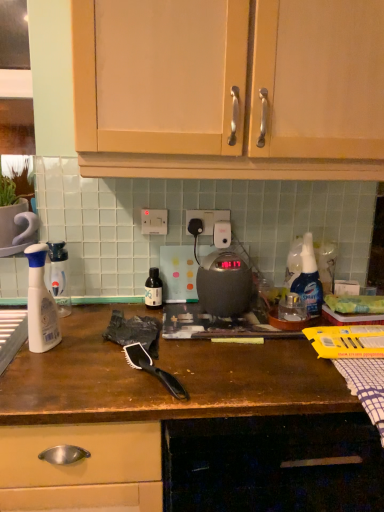
Locate an element on the screen. This screenshot has width=384, height=512. free spot in front of translucent plastic spray bottle at left is located at coordinates (39, 374).